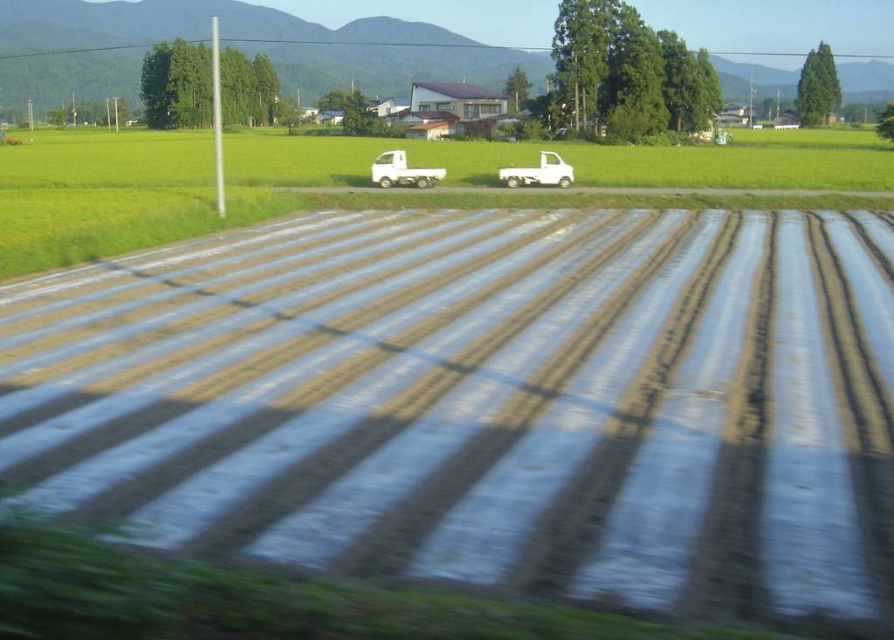
Question: Does white plastic truck at center appear on the left side of white matte truck at center?

Choices:
 (A) no
 (B) yes

Answer: (B)

Question: Does clear plastic field at center appear on the left side of white plastic truck at center?

Choices:
 (A) yes
 (B) no

Answer: (B)

Question: Which is nearer to the clear plastic field at center?

Choices:
 (A) white plastic truck at center
 (B) green grass field at center

Answer: (B)

Question: Does green grass field at center appear on the left side of white matte truck at center?

Choices:
 (A) yes
 (B) no

Answer: (A)

Question: Estimate the real-world distances between objects in this image. Which object is farther from the white matte truck at center?

Choices:
 (A) clear plastic field at center
 (B) green grass field at center

Answer: (B)

Question: Among these points, which one is nearest to the camera?

Choices:
 (A) (802, 140)
 (B) (370, 161)

Answer: (B)